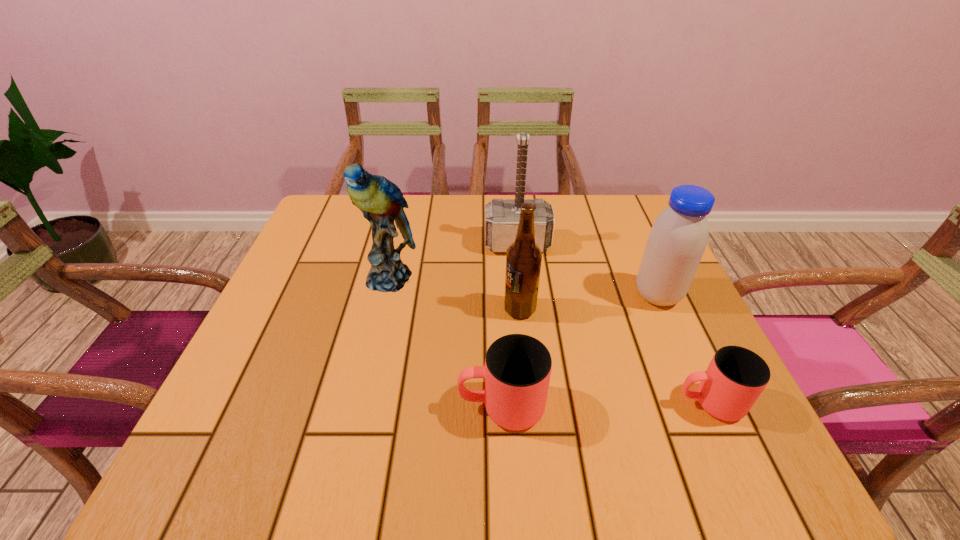
Locate an element on the screen. The width and height of the screenshot is (960, 540). free space that satisfies the following two spatial constraints: 1. on the face of the leftmost object; 2. on the handle side of the second shortest object is located at coordinates (359, 407).

Locate an element on the screen. vacant region that satisfies the following two spatial constraints: 1. on the handle side of the taller cup; 2. on the right side of the soya milk is located at coordinates (497, 295).

At what (x,y) coordinates should I click in order to perform the action: click on free spot that satisfies the following two spatial constraints: 1. on the label of the beer bottle; 2. on the handle side of the right cup. Please return your answer as a coordinate pair (x, y). The height and width of the screenshot is (540, 960). Looking at the image, I should click on (529, 403).

Find the location of a particular element. vacant space that satisfies the following two spatial constraints: 1. for striking with the head of the hammer; 2. on the label of the beer bottle is located at coordinates (524, 309).

Identify the location of free location that satisfies the following two spatial constraints: 1. for striking with the head of the hammer; 2. on the label of the beer bottle. The width and height of the screenshot is (960, 540). (524, 309).

Locate an element on the screen. The width and height of the screenshot is (960, 540). vacant point that satisfies the following two spatial constraints: 1. on the face of the parrot; 2. on the handle side of the shorter cup is located at coordinates (360, 403).